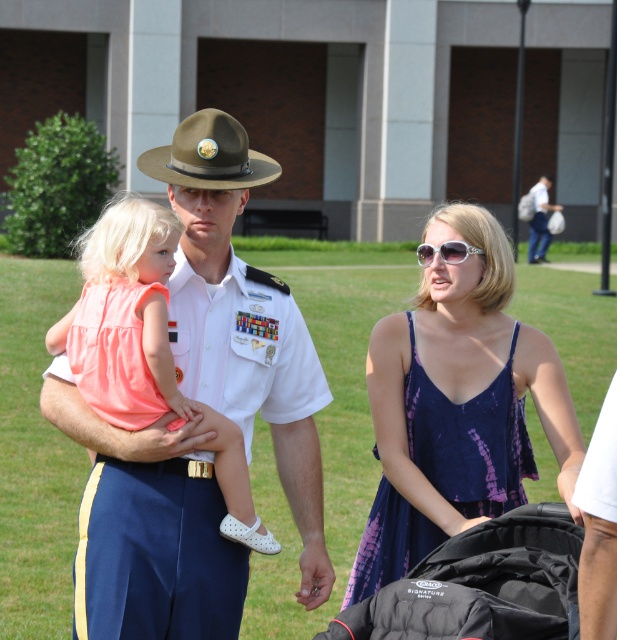
Question: Among these objects, which one is nearest to the camera?

Choices:
 (A) black fabric baby carriage at lower center
 (B) white uniform at center

Answer: (A)

Question: Which of the following is the farthest from the observer?

Choices:
 (A) white cotton shirt at upper right
 (B) purple tie-dye dress at center

Answer: (A)

Question: Can you confirm if white uniform at center is smaller than black fabric baby carriage at lower center?

Choices:
 (A) yes
 (B) no

Answer: (B)

Question: Does white uniform at center appear under white cotton shirt at upper right?

Choices:
 (A) yes
 (B) no

Answer: (A)

Question: Which of the following is the farthest from the observer?

Choices:
 (A) white uniform at center
 (B) white cotton shirt at upper right
 (C) black fabric baby carriage at lower center
 (D) purple tie-dye dress at center

Answer: (B)

Question: Does black fabric baby carriage at lower center appear under white cotton shirt at upper right?

Choices:
 (A) no
 (B) yes

Answer: (B)